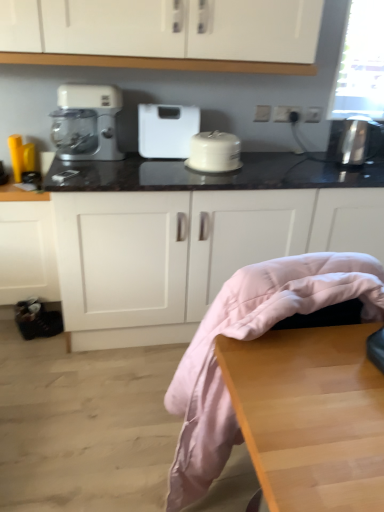
The image size is (384, 512). What do you see at coordinates (166, 130) in the screenshot?
I see `white plastic scale at center` at bounding box center [166, 130].

Describe the element at coordinates (310, 416) in the screenshot. This screenshot has height=512, width=384. I see `wooden table at lower right` at that location.

The height and width of the screenshot is (512, 384). What are the coordinates of `white glossy cake stand at center` in the screenshot? It's located at (214, 152).

Describe the element at coordinates (214, 152) in the screenshot. I see `white glossy cake stand at center` at that location.

Identify the location of black marble countertop at center. (194, 236).

The width and height of the screenshot is (384, 512). I want to click on white plastic mixer at left, so click(86, 122).

How many degrees apart are the facing directions of wooden table at lower right and satin silver toaster at right, which is the 1th appliance from right to left?

The angular difference between wooden table at lower right and satin silver toaster at right, which is the 1th appliance from right to left, is 0.933 degrees.

From the image's perspective, is wooden table at lower right positioned above or below satin silver toaster at right, which is the 1th appliance from right to left?

wooden table at lower right is below satin silver toaster at right, which is the 1th appliance from right to left.

Is point (356, 430) more distant than point (348, 122)?

That is False.

Looking at this image, how much distance is there between wooden table at lower right and satin silver toaster at right, the second appliance positioned from the left?

A distance of 1.54 meters exists between wooden table at lower right and satin silver toaster at right, the second appliance positioned from the left.

Considering the sizes of objects white plastic scale at center and white glossy cake stand at center in the image provided, who is smaller, white plastic scale at center or white glossy cake stand at center?

white glossy cake stand at center is smaller.

Which is correct: white plastic scale at center is inside white glossy cake stand at center, or outside of it?

The correct answer is: outside.

Consider the image. Is white plastic scale at center facing towards white glossy cake stand at center?

Yes, white plastic scale at center is turned towards white glossy cake stand at center.

From a real-world perspective, between white plastic scale at center and white glossy cake stand at center, who is vertically lower?

In real-world perspective, white glossy cake stand at center is lower.

Is satin silver toaster at right, the second appliance positioned from the left, aimed at black marble countertop at center?

No.

From the image's perspective, which object appears higher, satin silver toaster at right, which is the 1th appliance from right to left, or black marble countertop at center?

satin silver toaster at right, which is the 1th appliance from right to left, from the image's perspective.

Between satin silver toaster at right, the second appliance positioned from the left, and black marble countertop at center, which one has larger width?

black marble countertop at center is wider.

Between point (12, 142) and point (108, 143), which one is positioned behind?

The point (108, 143) is farther from the camera.

Between matte yellow kettle at left, which is the second appliance from right to left, and white plastic mixer at left, which one appears on the left side from the viewer's perspective?

Positioned to the left is matte yellow kettle at left, which is the second appliance from right to left.

From a real-world perspective, who is located higher, matte yellow kettle at left, which is the second appliance from right to left, or white plastic mixer at left?

white plastic mixer at left, from a real-world perspective.

Is matte yellow kettle at left, which is the second appliance from right to left, positioned behind white plastic mixer at left?

Yes, matte yellow kettle at left, which is the second appliance from right to left, is further from the camera.

The image size is (384, 512). What are the coordinates of `home appliance above the matte yellow kettle at left, which is the second appliance from right to left (from the image's perspective)` in the screenshot? It's located at 166,130.

Is matte yellow kettle at left, marked as the first appliance in a left-to-right arrangement, at the right side of white plastic scale at center?

No, matte yellow kettle at left, marked as the first appliance in a left-to-right arrangement, is not to the right of white plastic scale at center.

Considering the relative sizes of matte yellow kettle at left, marked as the first appliance in a left-to-right arrangement, and white plastic scale at center in the image provided, is matte yellow kettle at left, marked as the first appliance in a left-to-right arrangement, taller than white plastic scale at center?

Result: In fact, matte yellow kettle at left, marked as the first appliance in a left-to-right arrangement, may be shorter than white plastic scale at center.

Looking at their sizes, would you say matte yellow kettle at left, which is the second appliance from right to left, is wider or thinner than white plastic scale at center?

Considering their sizes, matte yellow kettle at left, which is the second appliance from right to left, looks slimmer than white plastic scale at center.

Between point (81, 113) and point (25, 150), which one is positioned behind?

The point (81, 113) is more distant.

Who is smaller, white plastic mixer at left or matte yellow kettle at left, marked as the first appliance in a left-to-right arrangement?

matte yellow kettle at left, marked as the first appliance in a left-to-right arrangement, is smaller.

This screenshot has width=384, height=512. I want to click on coffee maker lying above the matte yellow kettle at left, which is the second appliance from right to left (from the image's perspective), so click(x=86, y=122).

Consider the image. From their relative heights in the image, would you say white plastic mixer at left is taller or shorter than white glossy cake stand at center?

white plastic mixer at left is taller than white glossy cake stand at center.

Is white plastic mixer at left touching white glossy cake stand at center?

No, white plastic mixer at left is not beside white glossy cake stand at center.

From the image's perspective, which object appears higher, white plastic mixer at left or white glossy cake stand at center?

white plastic mixer at left.

In the scene shown: Is white plastic mixer at left inside the boundaries of white glossy cake stand at center, or outside?

white plastic mixer at left is located beyond the bounds of white glossy cake stand at center.

Identify the location of table located on the left of satin silver toaster at right, the second appliance positioned from the left. (310, 416).

I want to click on kitchen appliance on the right of white plastic scale at center, so click(x=214, y=152).

From the image, which object appears to be nearer to matte yellow kettle at left, marked as the first appliance in a left-to-right arrangement, white plastic scale at center or white plastic mixer at left?

white plastic mixer at left is positioned closer to the anchor matte yellow kettle at left, marked as the first appliance in a left-to-right arrangement.

Looking at this image, which object lies nearer to the anchor point satin silver toaster at right, the second appliance positioned from the left, black marble countertop at center or wooden table at lower right?

black marble countertop at center is closer to satin silver toaster at right, the second appliance positioned from the left.

Which object lies nearer to the anchor point satin silver toaster at right, which is the 1th appliance from right to left, white plastic mixer at left or white plastic scale at center?

Among the two, white plastic scale at center is located nearer to satin silver toaster at right, which is the 1th appliance from right to left.

When comparing their distances from satin silver toaster at right, which is the 1th appliance from right to left, does white plastic mixer at left or black marble countertop at center seem closer?

Among the two, black marble countertop at center is located nearer to satin silver toaster at right, which is the 1th appliance from right to left.

Which object lies nearer to the anchor point satin silver toaster at right, the second appliance positioned from the left, wooden table at lower right or white plastic scale at center?

Among the two, white plastic scale at center is located nearer to satin silver toaster at right, the second appliance positioned from the left.

Considering their positions, is white glossy cake stand at center positioned closer to matte yellow kettle at left, marked as the first appliance in a left-to-right arrangement, than wooden table at lower right?

white glossy cake stand at center.

When comparing their distances from white glossy cake stand at center, does white plastic mixer at left or matte yellow kettle at left, which is the second appliance from right to left, seem further?

matte yellow kettle at left, which is the second appliance from right to left.

From the image, which object appears to be farther from white plastic mixer at left, white plastic scale at center or satin silver toaster at right, the second appliance positioned from the left?

Among the two, satin silver toaster at right, the second appliance positioned from the left, is located further to white plastic mixer at left.

Locate an element on the screen. kitchen appliance between white plastic mixer at left and satin silver toaster at right, the second appliance positioned from the left is located at coordinates (214, 152).

Locate an element on the screen. The height and width of the screenshot is (512, 384). coffee maker located between matte yellow kettle at left, which is the second appliance from right to left, and satin silver toaster at right, which is the 1th appliance from right to left, in the left-right direction is located at coordinates (86, 122).

You are a GUI agent. You are given a task and a screenshot of the screen. Output one action in this format:
    pyautogui.click(x=<x>, y=<y>)
    Task: Click on the kitchen appliance located between white plastic scale at center and satin silver toaster at right, the second appliance positioned from the left, in the left-right direction
    The width and height of the screenshot is (384, 512).
    Given the screenshot: What is the action you would take?
    pyautogui.click(x=214, y=152)

Locate an element on the screen. This screenshot has height=512, width=384. countertop situated between white plastic mixer at left and satin silver toaster at right, the second appliance positioned from the left, from left to right is located at coordinates (194, 236).